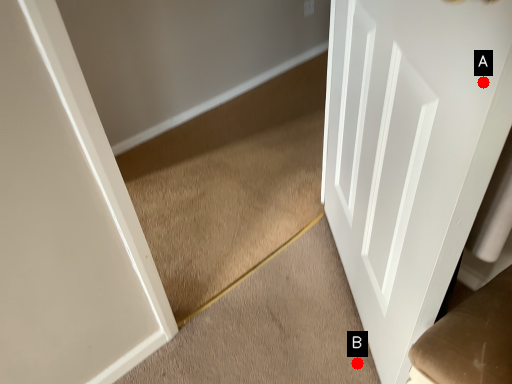
Question: Two points are circled on the image, labeled by A and B beside each circle. Among these points, which one is farthest from the camera?

Choices:
 (A) A is further
 (B) B is further

Answer: (B)